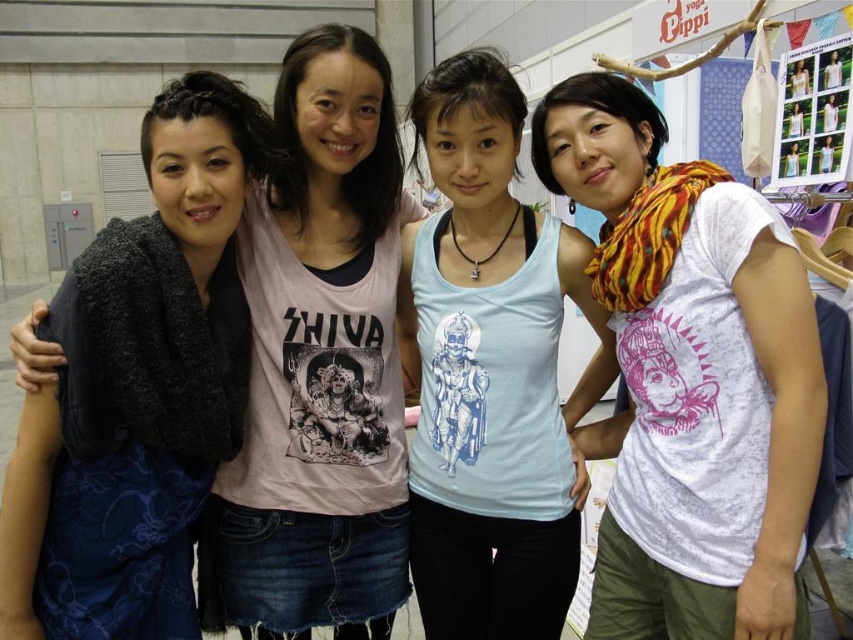
Question: Is white printed t-shirt at right positioned behind matte black scarf at left?

Choices:
 (A) yes
 (B) no

Answer: (B)

Question: Which object is farther from the camera taking this photo?

Choices:
 (A) white printed t-shirt at right
 (B) light blue tank top at center
 (C) matte black scarf at left

Answer: (C)

Question: Which object is farther from the camera taking this photo?

Choices:
 (A) matte black scarf at left
 (B) light blue tank top at center

Answer: (A)

Question: Is matte black scarf at left to the left of light blue tank top at center from the viewer's perspective?

Choices:
 (A) yes
 (B) no

Answer: (A)

Question: Can you confirm if white printed t-shirt at right is wider than matte black scarf at left?

Choices:
 (A) yes
 (B) no

Answer: (B)

Question: Which object appears farthest from the camera in this image?

Choices:
 (A) white printed t-shirt at right
 (B) matte black scarf at left
 (C) light blue tank top at center

Answer: (B)